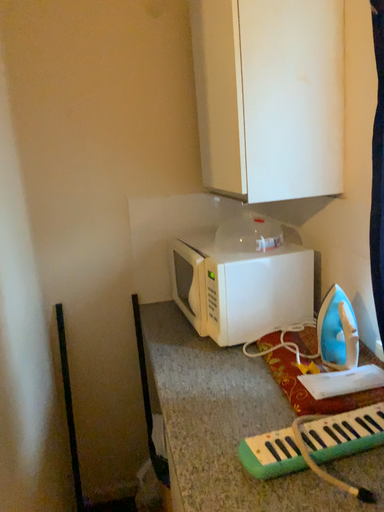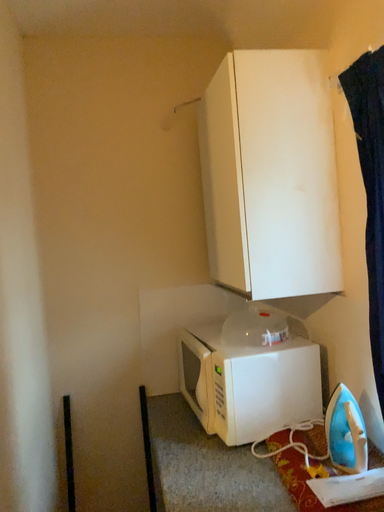
Question: Which way did the camera rotate in the video?

Choices:
 (A) rotated upward
 (B) rotated downward

Answer: (A)